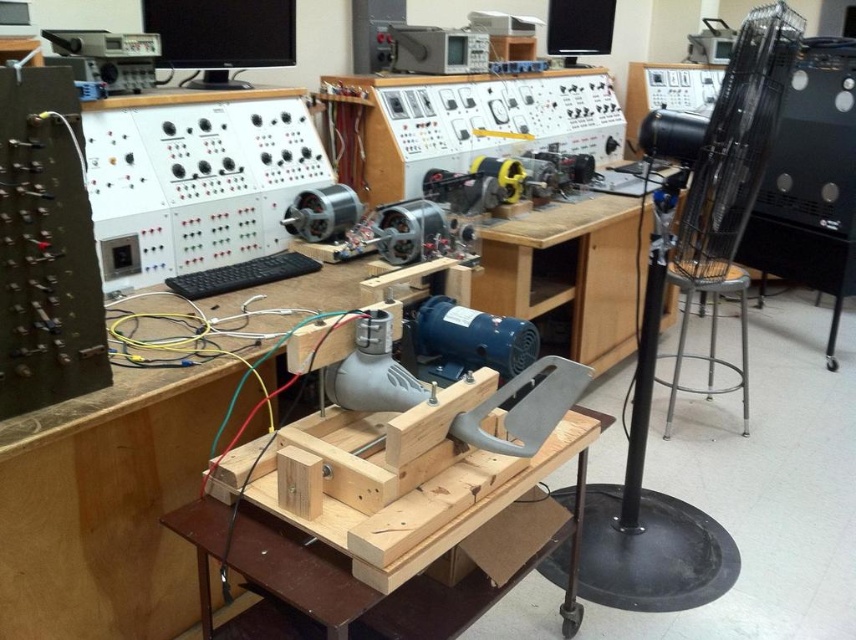
Based on the photo, you are an engineer working in the laboratory depicted in the image. You need to access both the point at coordinates point (x=351, y=604) and point (x=710, y=288). Which point should you approach first to reach the one further away from you?

You should approach point (x=351, y=604) first because it is in front of point (x=710, y=288), meaning it is closer to you and you can then move to the one further away.